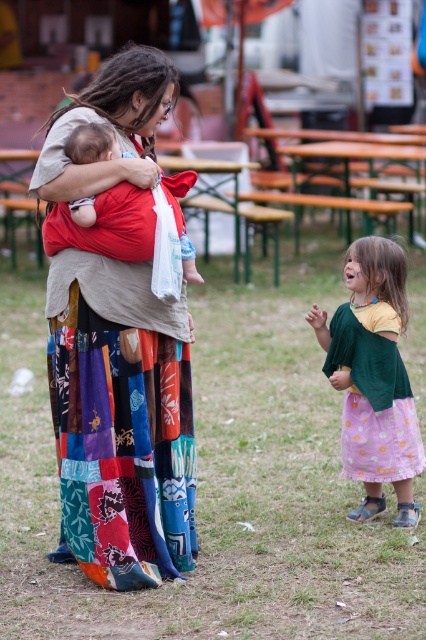
Question: Is multicolored patchwork skirt at center smaller than matte red baby carrier at center?

Choices:
 (A) yes
 (B) no

Answer: (B)

Question: Which of the following is the closest to the observer?

Choices:
 (A) (71, 216)
 (B) (51, 326)
 (C) (169, 426)

Answer: (A)

Question: Is the position of pastel floral dress at lower right more distant than that of matte red baby carrier at center?

Choices:
 (A) no
 (B) yes

Answer: (B)

Question: Which object is closer to the camera taking this photo?

Choices:
 (A) matte red baby carrier at center
 (B) multicolored patchwork skirt at center

Answer: (A)

Question: Is multicolored patchwork skirt at center wider than patchwork fabric skirt at center?

Choices:
 (A) yes
 (B) no

Answer: (A)

Question: Which point is closer to the camera?

Choices:
 (A) multicolored patchwork skirt at center
 (B) pastel floral dress at lower right
 (C) matte red baby carrier at center
 (D) patchwork fabric skirt at center

Answer: (C)